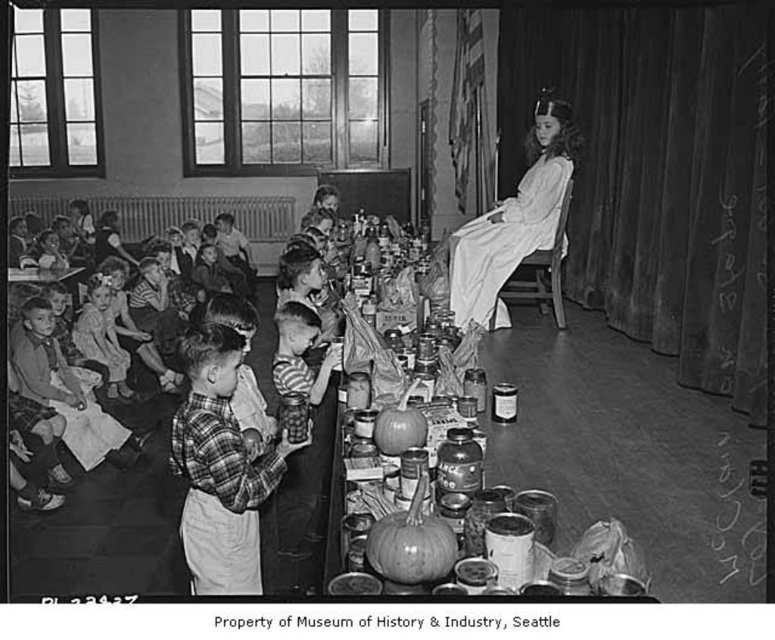
Based on the photo, you are a teacher in the classroom and you need to retrieve a book from the radiator beneath the window. To do so, you must pass between the plaid fabric shirt at center and the plaid shirt at lower left. Is there enough space for you to walk through?

The plaid fabric shirt at center is positioned under plaid shirt at lower left, meaning they are stacked vertically. Since they are not side by side, there is no path between them to walk through. You would need to move around them instead.

You are a photographer standing at the back of the classroom. You want to take a photo that includes both the white satin dress at center and the plaid shirt at lower left. Given that your camera has a maximum focus range of 10 feet, will you be able to capture both subjects in focus?

The white satin dress at center and plaid shirt at lower left are 11.18 feet apart from each other. Since the distance between them exceeds the camera maximum focus range of 10 feet, you will not be able to capture both subjects in focus.